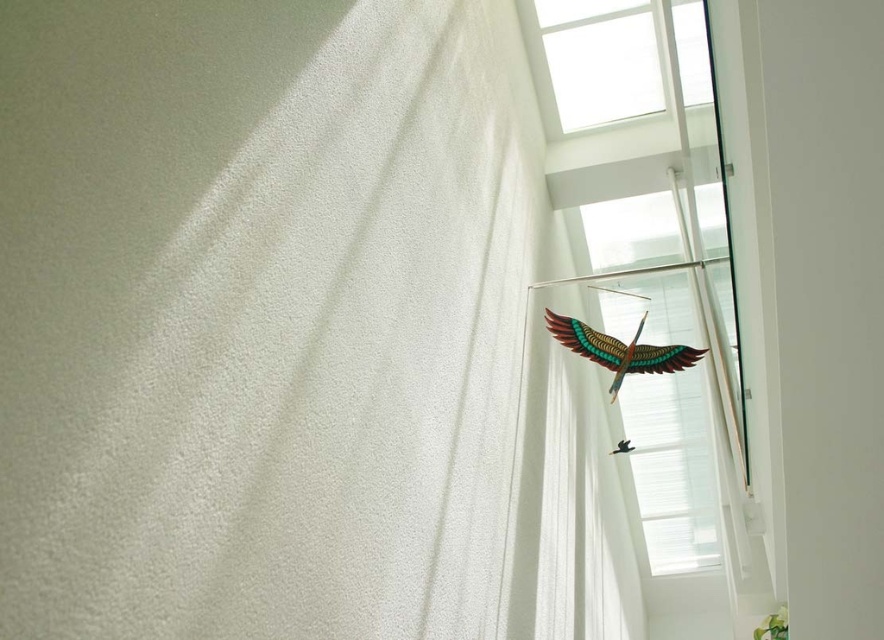
Does white textured curtain at upper right have a greater height compared to wooden bird at upper right?

In fact, white textured curtain at upper right may be shorter than wooden bird at upper right.

Looking at this image, is white textured curtain at upper right to the right of wooden bird at upper right from the viewer's perspective?

Incorrect, white textured curtain at upper right is not on the right side of wooden bird at upper right.

Between point (566, 630) and point (622, 339), which one is positioned in front?

Point (566, 630) is in front.

This screenshot has width=884, height=640. What are the coordinates of `white textured curtain at upper right` in the screenshot? It's located at (288, 332).

Which is above, wooden bird at upper right or transparent glass window at upper right?

Positioned higher is transparent glass window at upper right.

Can you confirm if wooden bird at upper right is positioned to the right of transparent glass window at upper right?

Yes, wooden bird at upper right is to the right of transparent glass window at upper right.

Where is `wooden bird at upper right`? wooden bird at upper right is located at coordinates (673, 468).

Between point (153, 416) and point (677, 90), which one is positioned in front?

Point (153, 416) is in front.

Can you confirm if white textured curtain at upper right is bigger than transparent glass window at upper right?

Indeed, white textured curtain at upper right has a larger size compared to transparent glass window at upper right.

In order to click on white textured curtain at upper right in this screenshot , I will do `click(288, 332)`.